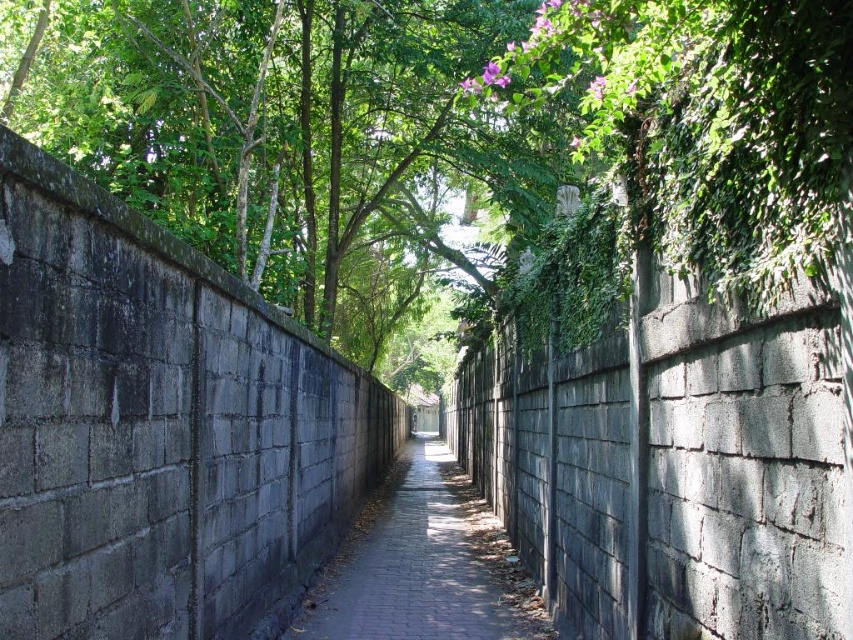
Question: Does green leafy tree at upper center have a smaller size compared to gray brick pavement at center?

Choices:
 (A) no
 (B) yes

Answer: (A)

Question: Among these objects, which one is nearest to the camera?

Choices:
 (A) green leafy tree at upper center
 (B) gray brick pavement at center

Answer: (B)

Question: Can you confirm if green leafy tree at upper center is positioned below gray brick pavement at center?

Choices:
 (A) no
 (B) yes

Answer: (A)

Question: Is green leafy tree at upper center to the right of gray brick pavement at center from the viewer's perspective?

Choices:
 (A) yes
 (B) no

Answer: (B)